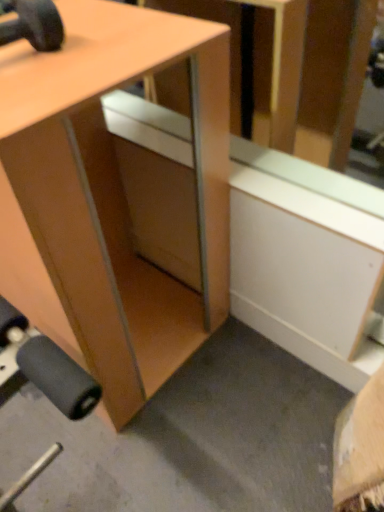
You are a GUI agent. You are given a task and a screenshot of the screen. Output one action in this format:
    pyautogui.click(x=<x>, y=<y>)
    Task: Click on the matte black dumbbell at upper left
    The height and width of the screenshot is (512, 384).
    Given the screenshot: What is the action you would take?
    pyautogui.click(x=35, y=25)

What do you see at coordinates (35, 25) in the screenshot?
I see `matte black dumbbell at upper left` at bounding box center [35, 25].

Describe the element at coordinates (108, 198) in the screenshot. I see `matte wood desk at center` at that location.

Identify the location of matte wood desk at center. This screenshot has width=384, height=512. (108, 198).

The height and width of the screenshot is (512, 384). What are the coordinates of `matte black dumbbell at upper left` in the screenshot? It's located at (35, 25).

Considering the positions of objects matte wood desk at center and matte black dumbbell at upper left in the image provided, who is more to the right, matte wood desk at center or matte black dumbbell at upper left?

matte wood desk at center is more to the right.

From the picture: Does matte wood desk at center come behind matte black dumbbell at upper left?

That is False.

Which point is more forward, (221, 236) or (32, 38)?

The point (32, 38) is closer to the camera.

From the image's perspective, which is below, matte wood desk at center or matte black dumbbell at upper left?

matte wood desk at center appears lower in the image.

From a real-world perspective, is matte wood desk at center positioned above or below matte black dumbbell at upper left?

matte wood desk at center is situated lower than matte black dumbbell at upper left in the real world.

Considering the relative sizes of matte wood desk at center and matte black dumbbell at upper left in the image provided, is matte wood desk at center thinner than matte black dumbbell at upper left?

In fact, matte wood desk at center might be wider than matte black dumbbell at upper left.

From the picture: From their relative heights in the image, would you say matte wood desk at center is taller or shorter than matte black dumbbell at upper left?

Considering their sizes, matte wood desk at center has more height than matte black dumbbell at upper left.

Is matte wood desk at center bigger or smaller than matte black dumbbell at upper left?

matte wood desk at center is bigger than matte black dumbbell at upper left.

Is matte wood desk at center completely or partially outside of matte black dumbbell at upper left?

Absolutely, matte wood desk at center is external to matte black dumbbell at upper left.

Is there a large distance between matte wood desk at center and matte black dumbbell at upper left?

No, matte wood desk at center is not far from matte black dumbbell at upper left.

Is matte wood desk at center turned away from matte black dumbbell at upper left?

No, matte wood desk at center's orientation is not away from matte black dumbbell at upper left.

The image size is (384, 512). Find the location of `dumbbell that is on the left side of matte wood desk at center`. dumbbell that is on the left side of matte wood desk at center is located at coordinates (35, 25).

Does matte black dumbbell at upper left appear on the right side of matte wood desk at center?

No, matte black dumbbell at upper left is not to the right of matte wood desk at center.

Considering their positions, is matte black dumbbell at upper left located in front of or behind matte wood desk at center?

matte black dumbbell at upper left is positioned farther from the viewer than matte wood desk at center.

Considering the points (12, 25) and (60, 317), which point is in front, point (12, 25) or point (60, 317)?

Point (12, 25)

From the image's perspective, between matte black dumbbell at upper left and matte wood desk at center, which one is located above?

matte black dumbbell at upper left, from the image's perspective.

From a real-world perspective, is matte black dumbbell at upper left under matte wood desk at center?

Incorrect, from a real-world perspective, matte black dumbbell at upper left is higher than matte wood desk at center.

Can you confirm if matte black dumbbell at upper left is wider than matte wood desk at center?

No.

From their relative heights in the image, would you say matte black dumbbell at upper left is taller or shorter than matte wood desk at center?

In the image, matte black dumbbell at upper left appears to be shorter than matte wood desk at center.

Is matte black dumbbell at upper left bigger than matte wood desk at center?

Actually, matte black dumbbell at upper left might be smaller than matte wood desk at center.

Is matte black dumbbell at upper left not inside matte wood desk at center?

Yes, matte black dumbbell at upper left is located beyond the bounds of matte wood desk at center.

Are matte black dumbbell at upper left and matte wood desk at center making contact?

No, matte black dumbbell at upper left is not with matte wood desk at center.

Is matte black dumbbell at upper left turned away from matte wood desk at center?

No, matte black dumbbell at upper left is not facing away from matte wood desk at center.

Can you tell me how much matte black dumbbell at upper left and matte wood desk at center differ in facing direction?

The facing directions of matte black dumbbell at upper left and matte wood desk at center are 1.64 degrees apart.

The image size is (384, 512). Identify the location of desk on the right of the matte black dumbbell at upper left. (108, 198).

Find the location of `desk in front of the matte black dumbbell at upper left`. desk in front of the matte black dumbbell at upper left is located at coordinates (108, 198).

At what (x,y) coordinates should I click in order to perform the action: click on desk lying on the right of matte black dumbbell at upper left. Please return your answer as a coordinate pair (x, y). This screenshot has width=384, height=512. Looking at the image, I should click on (108, 198).